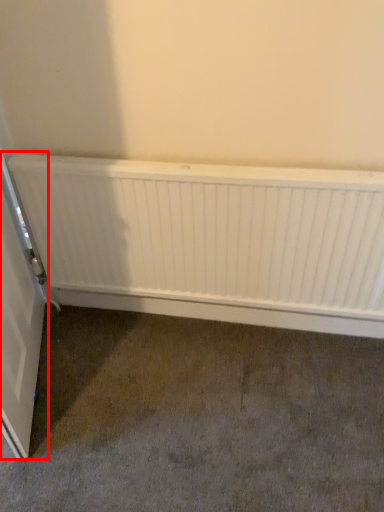
Question: Where is door (annotated by the red box) located in relation to radiator in the image?

Choices:
 (A) left
 (B) right

Answer: (A)